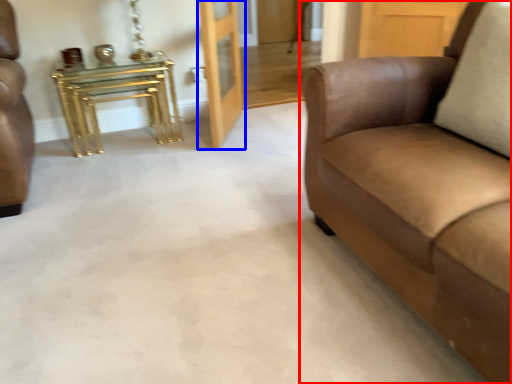
Question: Among these objects, which one is nearest to the camera, studio couch (highlighted by a red box) or door (highlighted by a blue box)?

Choices:
 (A) studio couch
 (B) door

Answer: (A)